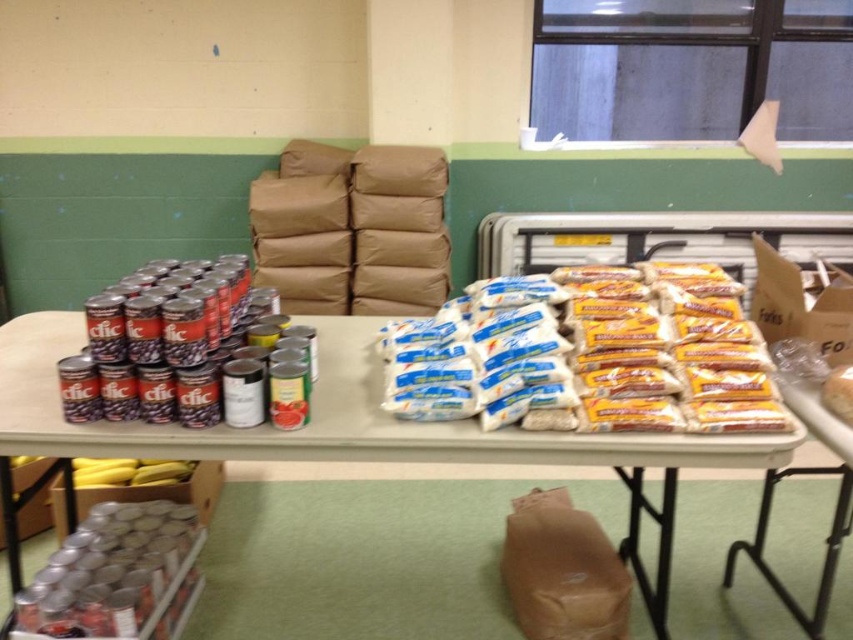
Which of these two, white paper bag at center or white plastic table at center, stands shorter?

white paper bag at center is shorter.

Between white paper bag at center and white plastic table at center, which one is positioned lower?

white plastic table at center is lower down.

Where is `white paper bag at center`? This screenshot has width=853, height=640. white paper bag at center is located at coordinates (589, 355).